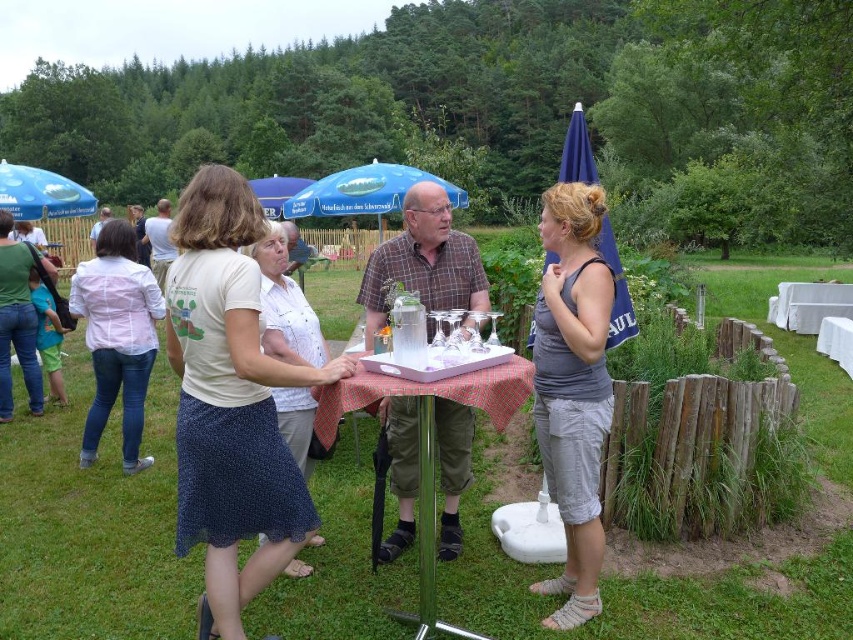
Question: Estimate the real-world distances between objects in this image. Which object is closer to the white cotton shirt at center?

Choices:
 (A) white marble table at right
 (B) navy blue fabric umbrella at upper right

Answer: (B)

Question: Which object is closer to the camera taking this photo?

Choices:
 (A) blue fabric umbrella at upper center
 (B) checkered fabric table at center
 (C) white cotton shirt at center
 (D) white cotton blouse at center

Answer: (B)

Question: Does gray cotton tank top at center have a smaller size compared to blue fabric umbrella at upper center?

Choices:
 (A) no
 (B) yes

Answer: (B)

Question: Can you confirm if checkered fabric table at center is wider than navy blue fabric umbrella at upper right?

Choices:
 (A) no
 (B) yes

Answer: (A)

Question: Does white cotton blouse at center appear under blue fabric umbrella at upper left?

Choices:
 (A) no
 (B) yes

Answer: (B)

Question: Which point appears closest to the camera in this image?

Choices:
 (A) (566, 346)
 (B) (633, 321)

Answer: (A)